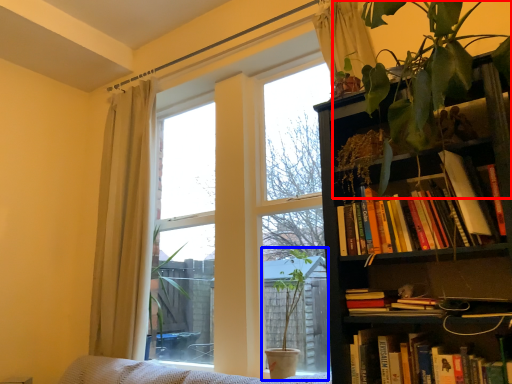
Question: Which of the following is the farthest to the observer, vegetation (highlighted by a red box) or houseplant (highlighted by a blue box)?

Choices:
 (A) vegetation
 (B) houseplant

Answer: (B)